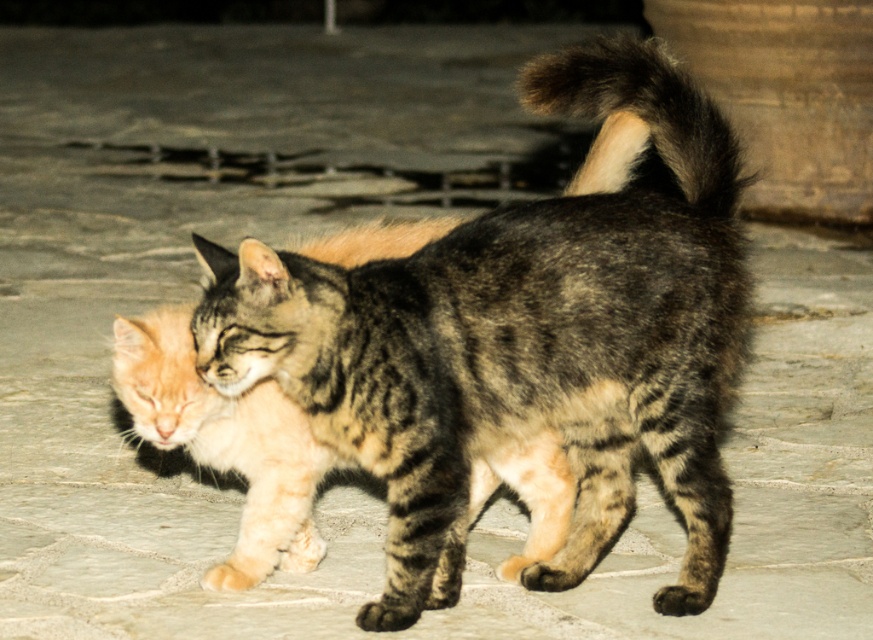
Question: Can you confirm if orange fur cat at center is smaller than dark brown fur tail at upper right?

Choices:
 (A) no
 (B) yes

Answer: (A)

Question: Which point is farther to the camera?

Choices:
 (A) (674, 144)
 (B) (253, 577)

Answer: (B)

Question: Which point is closer to the camera?

Choices:
 (A) orange fur cat at center
 (B) dark brown fur tail at upper right

Answer: (B)

Question: Can you confirm if orange fur cat at center is thinner than dark brown fur tail at upper right?

Choices:
 (A) no
 (B) yes

Answer: (A)

Question: Among these points, which one is farthest from the camera?

Choices:
 (A) (148, 426)
 (B) (523, 68)

Answer: (B)

Question: Considering the relative positions of orange fur cat at center and dark brown fur tail at upper right in the image provided, where is orange fur cat at center located with respect to dark brown fur tail at upper right?

Choices:
 (A) right
 (B) left

Answer: (B)